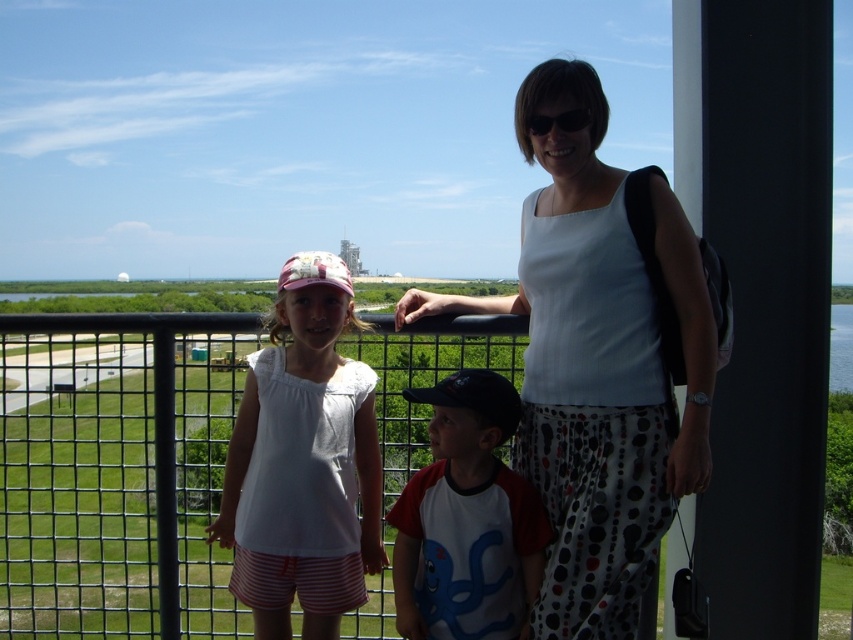
Question: Which point appears farthest from the camera in this image?

Choices:
 (A) (399, 600)
 (B) (576, 140)
 (C) (344, 524)

Answer: (C)

Question: Which is farther from the white dotted pants at center?

Choices:
 (A) white cotton shirt at center
 (B) red and white jersey at center

Answer: (A)

Question: Can you confirm if white dotted pants at center is wider than red and white jersey at center?

Choices:
 (A) yes
 (B) no

Answer: (A)

Question: Does white dotted pants at center appear on the right side of red and white jersey at center?

Choices:
 (A) yes
 (B) no

Answer: (A)

Question: Does white cotton shirt at center have a lesser width compared to red and white jersey at center?

Choices:
 (A) no
 (B) yes

Answer: (B)

Question: Among these objects, which one is nearest to the camera?

Choices:
 (A) red and white jersey at center
 (B) white cotton shirt at center
 (C) white dotted pants at center

Answer: (C)